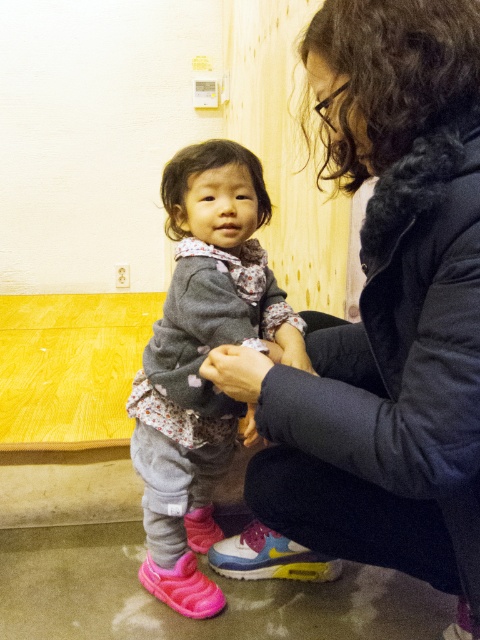
You are a photographer trying to capture a closeup of the matte black jacket at center. Given that your camera has a focal length of 50mm and you are currently 2 meters away from the jacket, can you estimate whether you need to move closer or farther away to achieve focus? Please consider the depth of field and the camera settings.

The question cannot be answered with the provided information as the depth of field and camera settings are not specified in the scene or object descriptions.